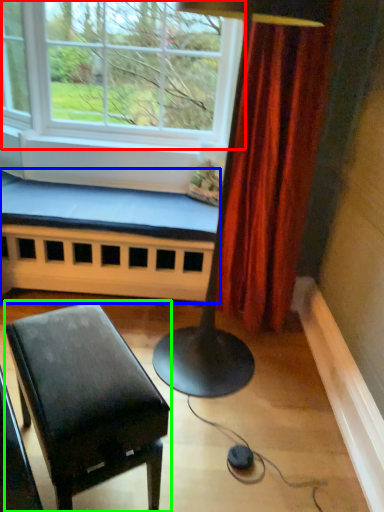
Question: Which object is positioned closest to window (highlighted by a red box)? Select from church bench (highlighted by a blue box) and table (highlighted by a green box).

Choices:
 (A) church bench
 (B) table

Answer: (A)